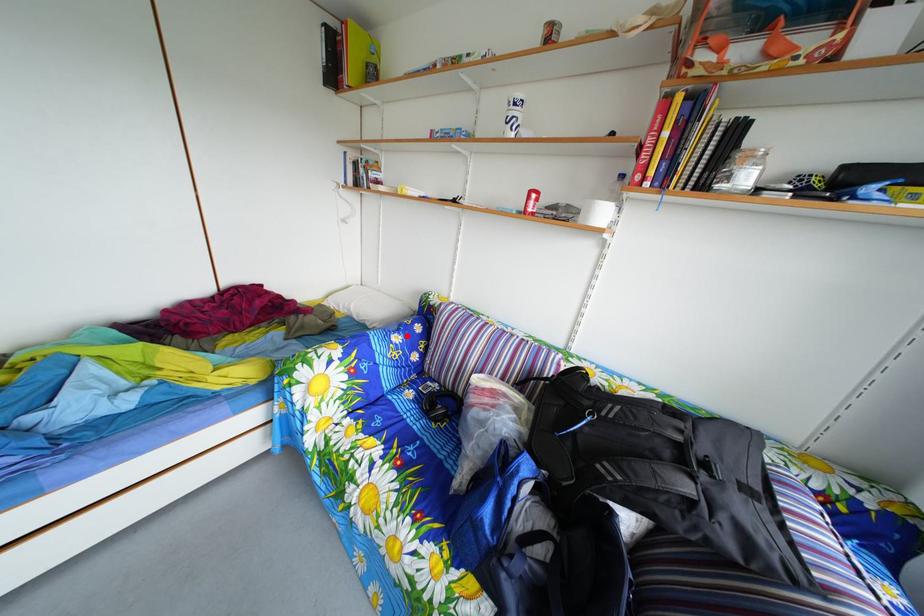
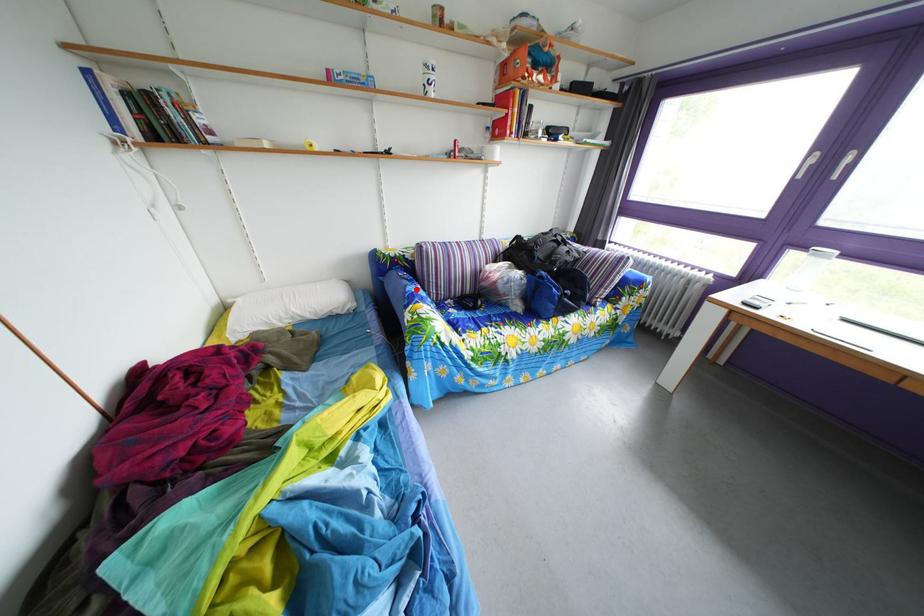
I am providing you with two images of the same scene from different viewpoints. A red point is marked on the first image and another point is marked on the second image. Are the points marked in image1 and image2 representing the same 3D position?

Yes